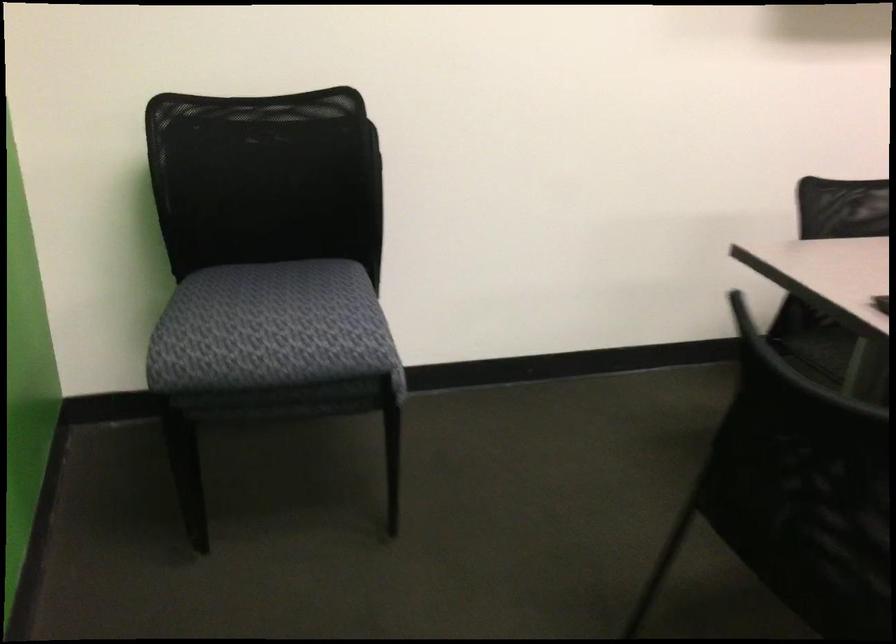
You are a GUI agent. You are given a task and a screenshot of the screen. Output one action in this format:
    pyautogui.click(x=<x>, y=<y>)
    Task: Click on the chair sitting surface
    The image size is (896, 644).
    Given the screenshot: What is the action you would take?
    pyautogui.click(x=271, y=328)